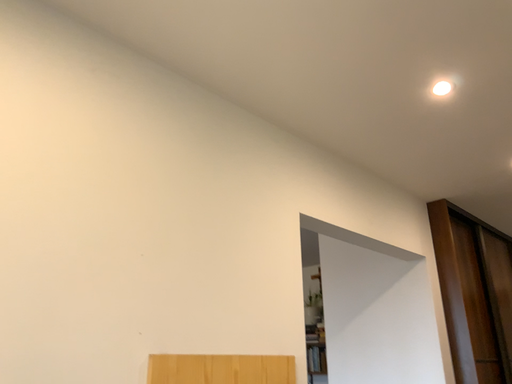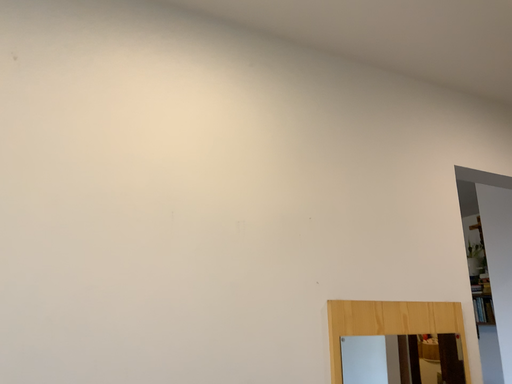
Question: Which way did the camera rotate in the video?

Choices:
 (A) rotated right
 (B) rotated left

Answer: (B)